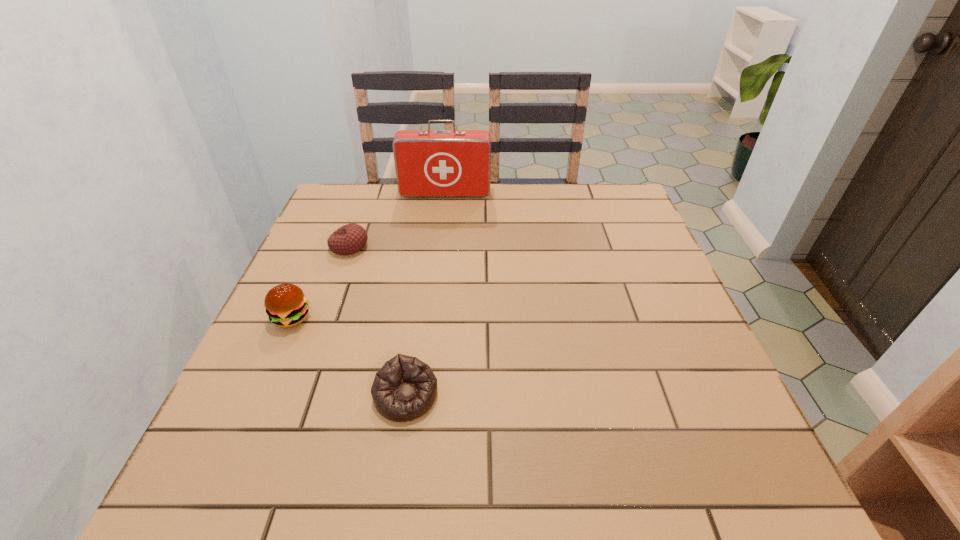
In the image, there is a desktop. At what (x,y) coordinates should I click in order to perform the action: click on vacant area at the far right corner. Please return your answer as a coordinate pair (x, y). This screenshot has height=540, width=960. Looking at the image, I should click on 588,187.

At what (x,y) coordinates should I click in order to perform the action: click on vacant space at the near right corner of the desktop. Please return your answer as a coordinate pair (x, y). The height and width of the screenshot is (540, 960). Looking at the image, I should click on (751, 469).

At what (x,y) coordinates should I click in order to perform the action: click on free spot between the right beanbag and the tallest object. Please return your answer as a coordinate pair (x, y). This screenshot has width=960, height=540. Looking at the image, I should click on (425, 295).

Locate an element on the screen. vacant space that's between the hamburger and the farthest object is located at coordinates (369, 256).

The height and width of the screenshot is (540, 960). In order to click on vacant area between the left beanbag and the second nearest object in this screenshot , I will do `click(321, 282)`.

In order to click on free space between the first-aid kit and the second nearest object in this screenshot , I will do `click(369, 256)`.

This screenshot has height=540, width=960. Identify the location of vacant area between the tallest object and the nearer beanbag. (425, 295).

Find the location of `vacant point located between the hamburger and the farther beanbag`. vacant point located between the hamburger and the farther beanbag is located at coordinates (321, 282).

Identify the location of free space between the farthest object and the second nearest object. Image resolution: width=960 pixels, height=540 pixels. (369, 256).

Locate an element on the screen. free point between the first-aid kit and the nearer beanbag is located at coordinates (425, 295).